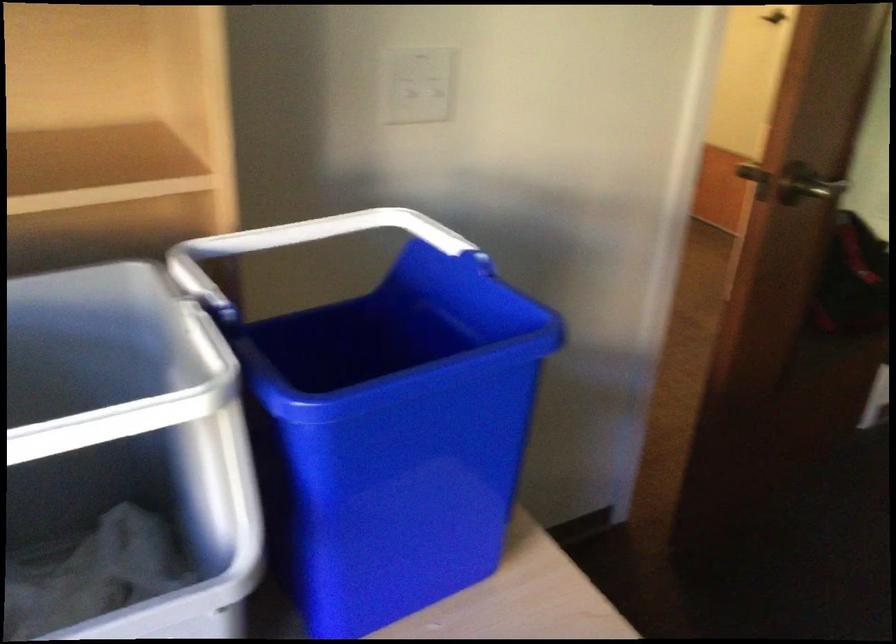
The width and height of the screenshot is (896, 644). What do you see at coordinates (213, 257) in the screenshot?
I see `the white basket handle` at bounding box center [213, 257].